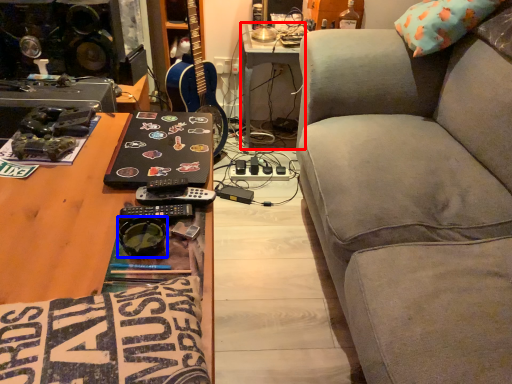
Question: Which point is further to the camera, table (highlighted by a red box) or goggles (highlighted by a blue box)?

Choices:
 (A) table
 (B) goggles

Answer: (A)